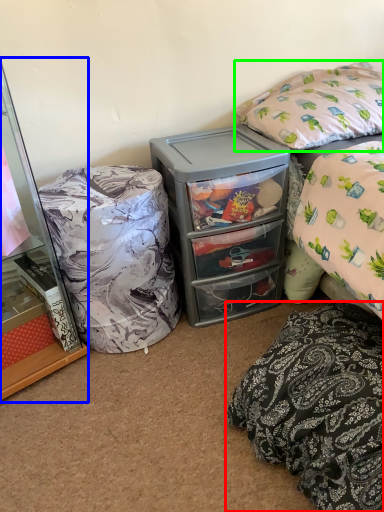
Question: Estimate the real-world distances between objects in this image. Which object is closer to pillow (highlighted by a red box), cabinetry (highlighted by a blue box) or pillow (highlighted by a green box)?

Choices:
 (A) cabinetry
 (B) pillow

Answer: (B)